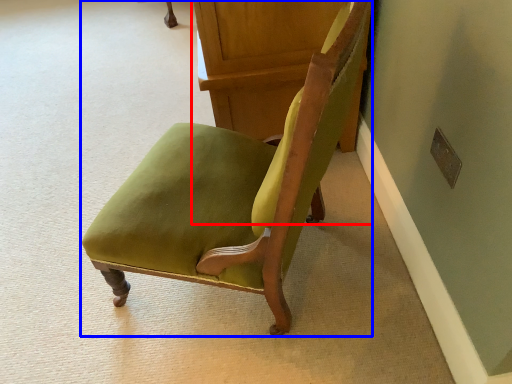
Question: Which point is further to the camera, furniture (highlighted by a red box) or chair (highlighted by a blue box)?

Choices:
 (A) furniture
 (B) chair

Answer: (A)